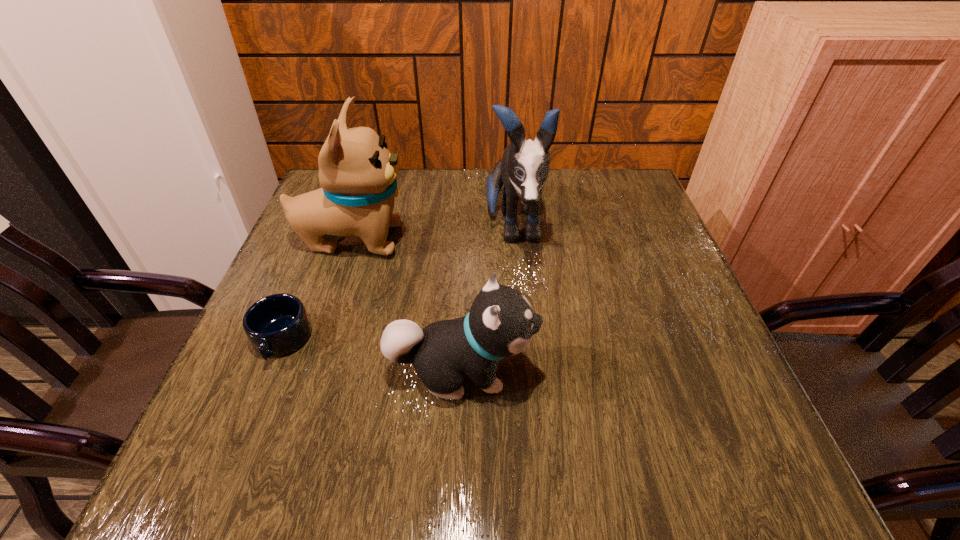
At what (x,y) coordinates should I click in order to perform the action: click on vacant region at the far edge. Please return your answer as a coordinate pair (x, y). Looking at the image, I should click on (425, 193).

Locate an element on the screen. vacant space at the left edge is located at coordinates (303, 368).

The height and width of the screenshot is (540, 960). Find the location of `free space at the right edge of the desktop`. free space at the right edge of the desktop is located at coordinates (654, 360).

The image size is (960, 540). I want to click on vacant space at the far right corner, so click(x=631, y=196).

Where is `vacant space at the near right corner of the desktop`? The image size is (960, 540). vacant space at the near right corner of the desktop is located at coordinates (702, 438).

The image size is (960, 540). Find the location of `vacant region between the leftmost puppy and the nearest puppy`. vacant region between the leftmost puppy and the nearest puppy is located at coordinates (407, 305).

In order to click on vacant area that lies between the mug and the nearest puppy in this screenshot , I will do `click(372, 355)`.

I want to click on vacant space that is in between the shortest object and the leftmost puppy, so click(x=317, y=290).

This screenshot has height=540, width=960. I want to click on free space between the third tallest object and the leftmost puppy, so click(407, 305).

The width and height of the screenshot is (960, 540). What are the coordinates of `free space between the leftmost puppy and the third tallest object` in the screenshot? It's located at (407, 305).